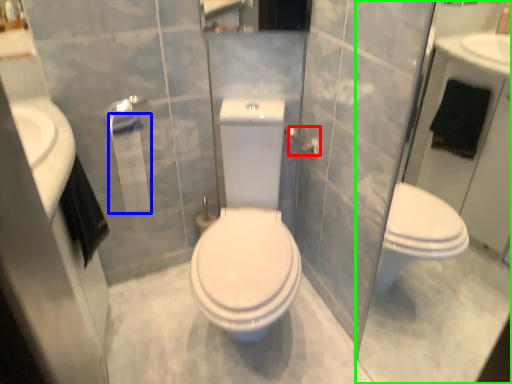
Question: Considering the real-world distances, which object is closest to towel bar (highlighted by a red box)? toilet paper (highlighted by a blue box) or glass door (highlighted by a green box).

Choices:
 (A) toilet paper
 (B) glass door

Answer: (A)